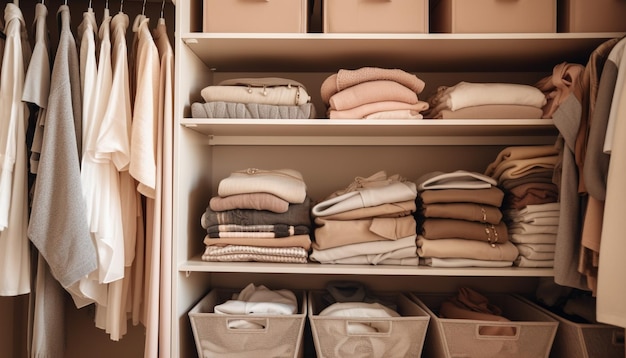
This screenshot has width=626, height=358. I want to click on baskets on the left, so click(240, 340), click(346, 345), click(244, 13), click(369, 20).